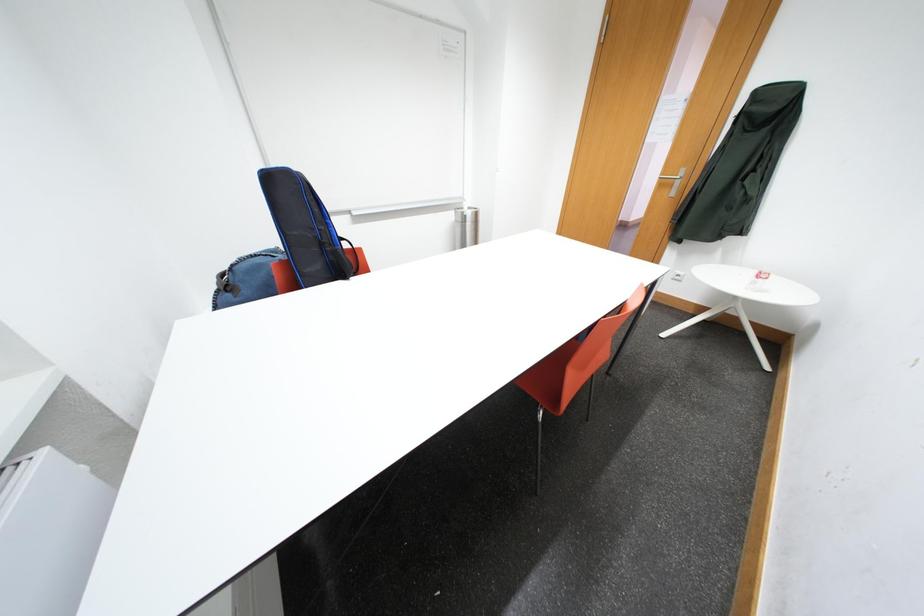
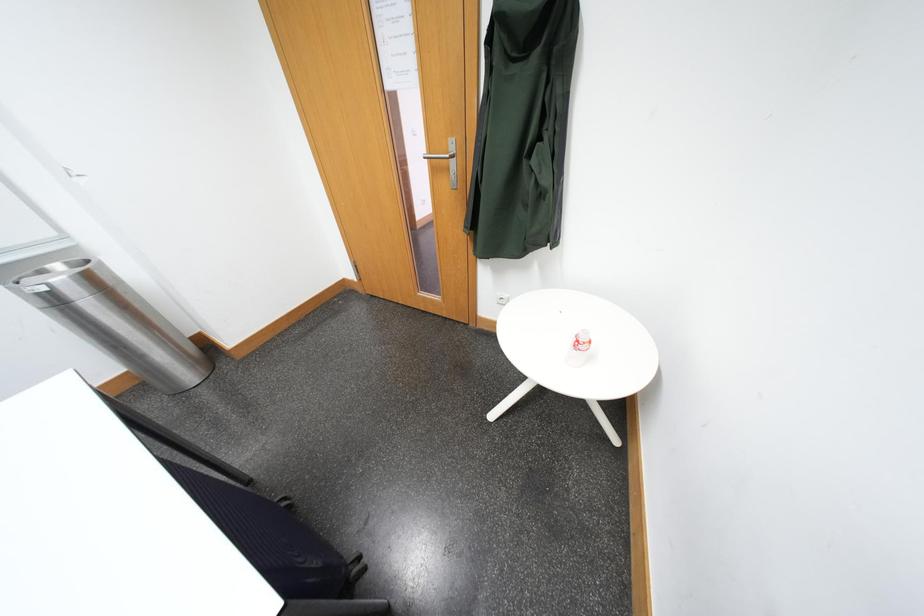
What movement of the cameraman would produce the second image?

The cameraman moved toward right, forward.